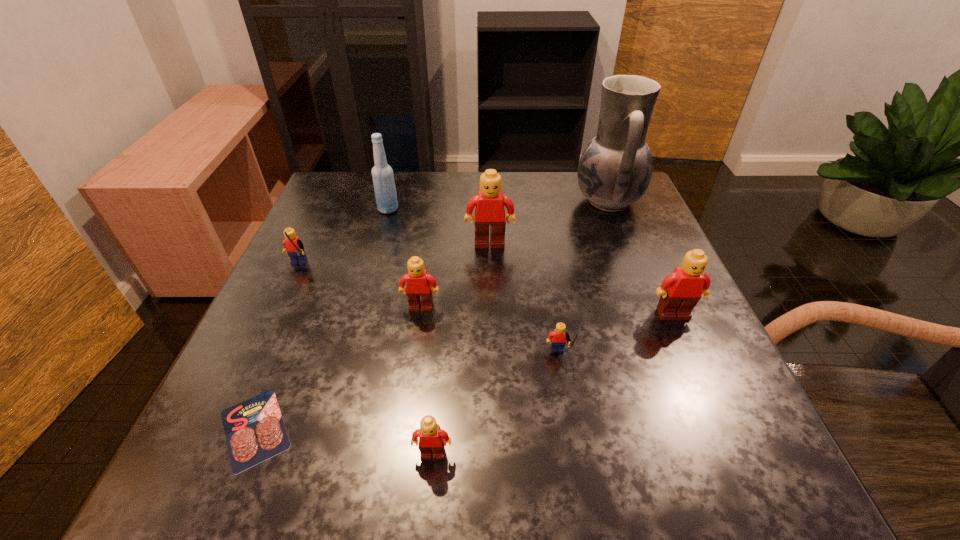
You are a GUI agent. You are given a task and a screenshot of the screen. Output one action in this format:
    pyautogui.click(x=<x>, y=<y>)
    Task: Click on the free space located on the face of the second smallest brown Lego
    
    Given the screenshot: What is the action you would take?
    pyautogui.click(x=397, y=480)

The width and height of the screenshot is (960, 540). What are the coordinates of `blank space located on the front-facing side of the left yellow Lego` in the screenshot? It's located at (262, 341).

Locate an element on the screen. vacant area situated on the front-facing side of the third object from right to left is located at coordinates (578, 472).

Locate an element on the screen. Image resolution: width=960 pixels, height=540 pixels. pitcher present at the far edge is located at coordinates (615, 169).

Identify the location of bottle located at the far edge. (383, 179).

I want to click on Lego located at the near edge, so click(x=432, y=439).

Locate an element on the screen. The image size is (960, 540). salami that is at the near edge is located at coordinates (254, 429).

At what (x,y) coordinates should I click in order to perform the action: click on bottle that is at the left edge. Please return your answer as a coordinate pair (x, y). This screenshot has width=960, height=540. Looking at the image, I should click on (383, 179).

Locate an element on the screen. The width and height of the screenshot is (960, 540). Lego that is at the left edge is located at coordinates (292, 244).

Find the location of `salami that is at the left edge`. salami that is at the left edge is located at coordinates (254, 429).